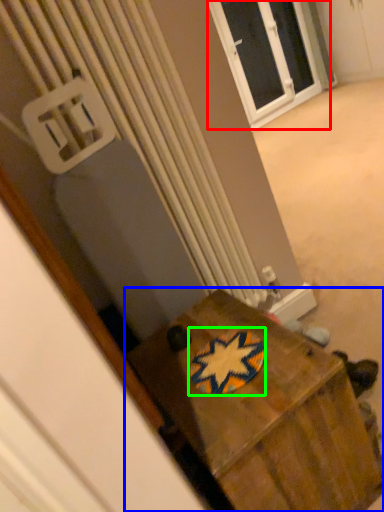
Question: Considering the real-world distances, which object is farthest from window (highlighted by a red box)? furniture (highlighted by a blue box) or design (highlighted by a green box)?

Choices:
 (A) furniture
 (B) design

Answer: (B)